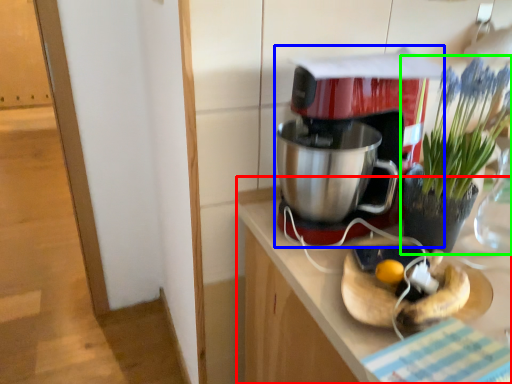
Question: Considering the real-world distances, which object is farthest from counter (highlighted by a red box)? coffee maker (highlighted by a blue box) or houseplant (highlighted by a green box)?

Choices:
 (A) coffee maker
 (B) houseplant

Answer: (B)